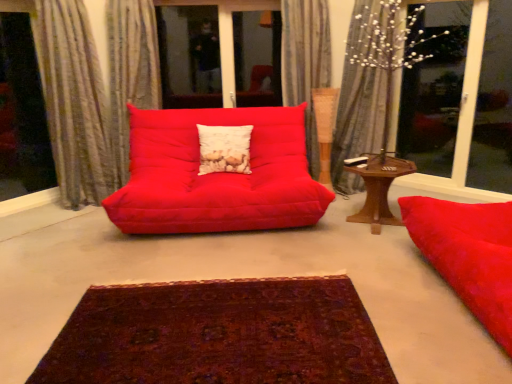
Where is `empty space that is in between wooden hexagonal table at right and deep burgundy woven rug at center`? empty space that is in between wooden hexagonal table at right and deep burgundy woven rug at center is located at coordinates (307, 261).